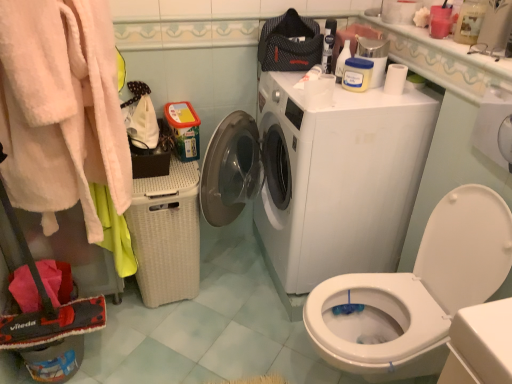
Locate an element on the screen. This screenshot has width=512, height=384. free space that is to the left of white matte toilet paper at upper right, arranged as the second toilet paper when viewed from the front is located at coordinates (353, 96).